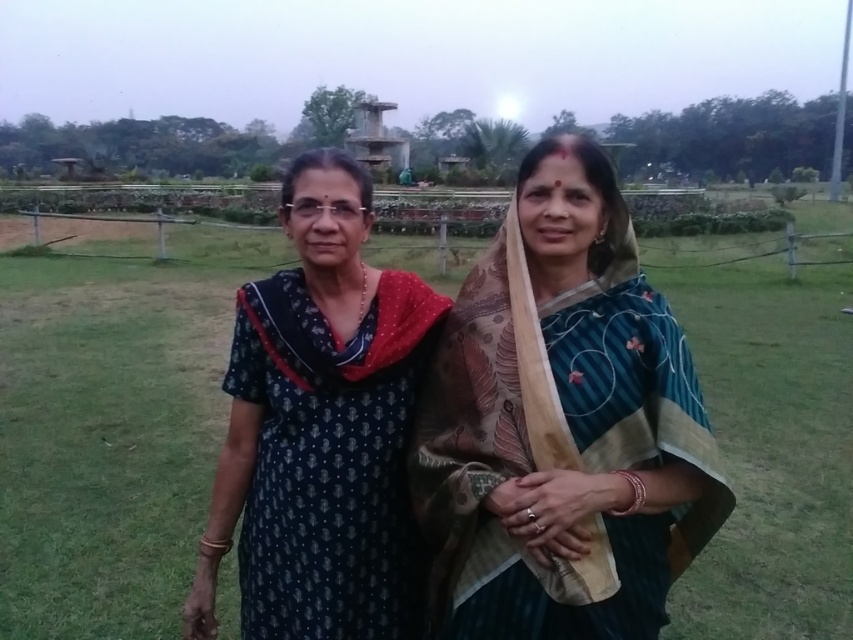
You are standing in the park and see two points marked in the image. The first point is labeled as point [700,324] and the second as point [281,449]. Which point is closer to you?

Point [281,449] is closer to you because point [700,324] is behind it.

You are a photographer trying to capture both women in a single frame. Since the dark blue fabric dress at center and the dark blue printed dress at center are both at the center, which one should you adjust to ensure both are fully visible in the photo?

The dark blue fabric dress at center is taller than the dark blue printed dress at center, so adjusting the camera angle slightly downward will ensure both are fully visible in the photo.

You are a photographer setting up a shot in the park. You need to position two subjects wearing the embroidered silk saree at center and dark blue printed dress at center. Which outfit will require more space to avoid overlapping in the frame?

The dark blue printed dress at center requires more space because it has a greater width than the embroidered silk saree at center, so positioning it properly to avoid overlapping will need a wider area.